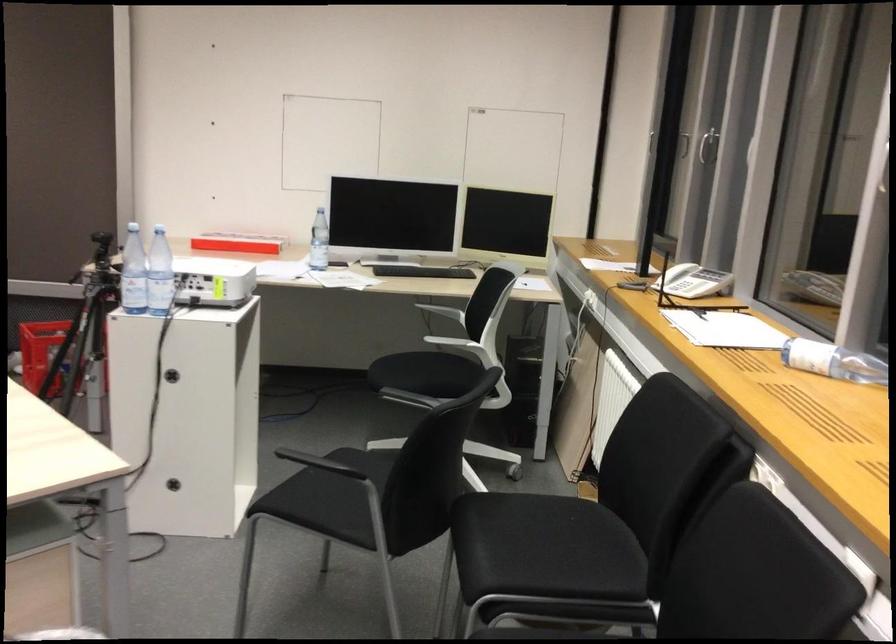
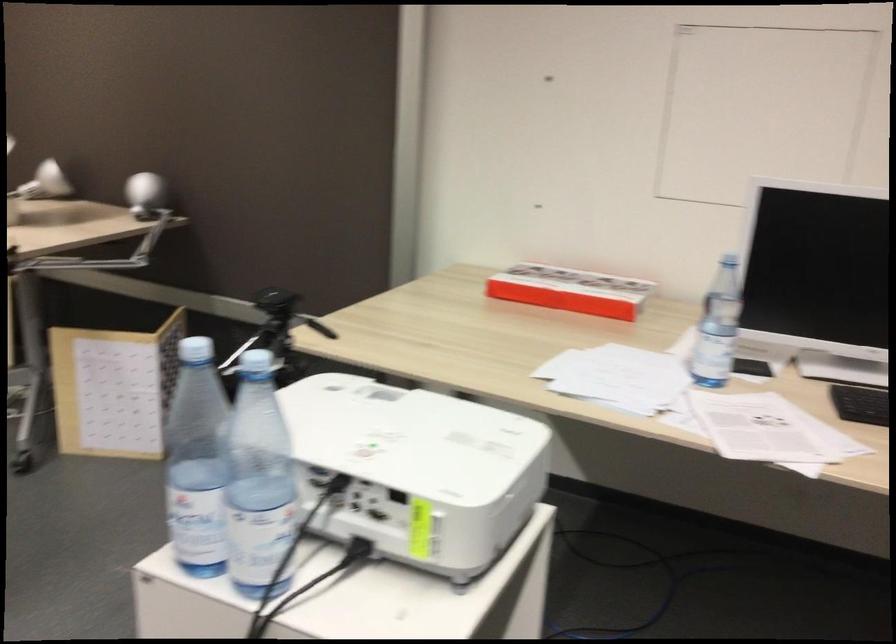
Question: In a continuous first-person perspective shot, in which direction is the camera moving?

Choices:
 (A) Left
 (B) Right
 (C) Forward
 (D) Backward

Answer: (C)